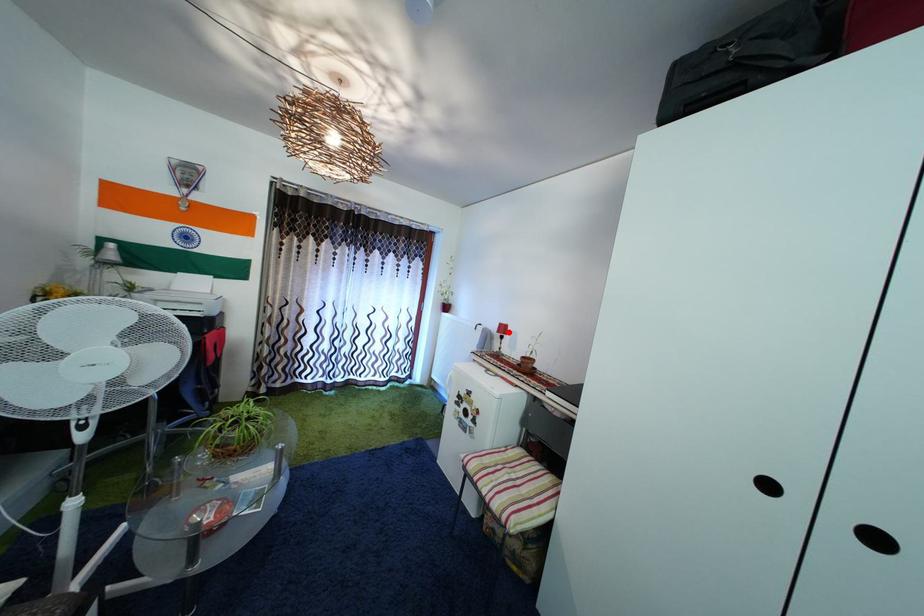
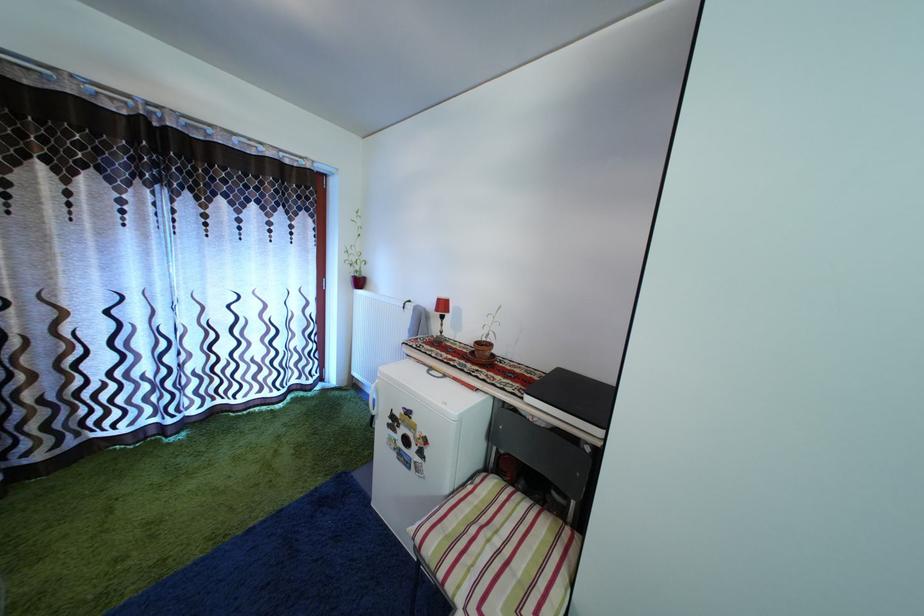
Where in the second image is the point corresponding to the highlighted location from the first image?

(446, 308)